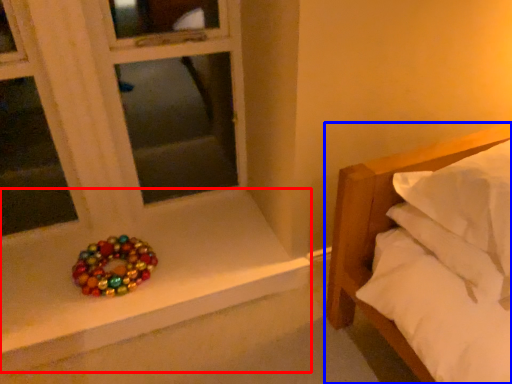
Question: Among these objects, which one is farthest to the camera, window sill (highlighted by a red box) or bed (highlighted by a blue box)?

Choices:
 (A) window sill
 (B) bed

Answer: (A)